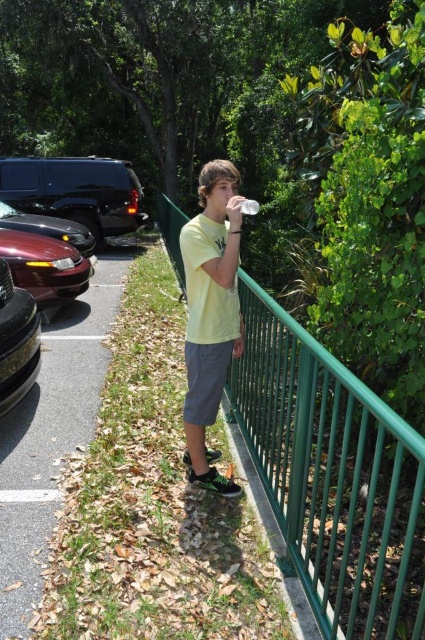
Question: Is green metal fence at right thinner than asphalt at lower left?

Choices:
 (A) yes
 (B) no

Answer: (B)

Question: Which object appears closest to the camera in this image?

Choices:
 (A) yellow matte shirt at center
 (B) shiny maroon sedan at left

Answer: (A)

Question: Which of these objects is positioned farthest from the shiny black suv at left?

Choices:
 (A) yellow matte shirt at center
 (B) shiny black car at left
 (C) shiny black sedan at left
 (D) green metal fence at right

Answer: (A)

Question: Which is farther from the shiny maroon sedan at left?

Choices:
 (A) green metal fence at right
 (B) asphalt at lower left

Answer: (A)

Question: Can you confirm if asphalt at lower left is thinner than shiny maroon sedan at left?

Choices:
 (A) yes
 (B) no

Answer: (A)

Question: In this image, where is yellow matte shirt at center located relative to shiny black car at left?

Choices:
 (A) below
 (B) above

Answer: (B)